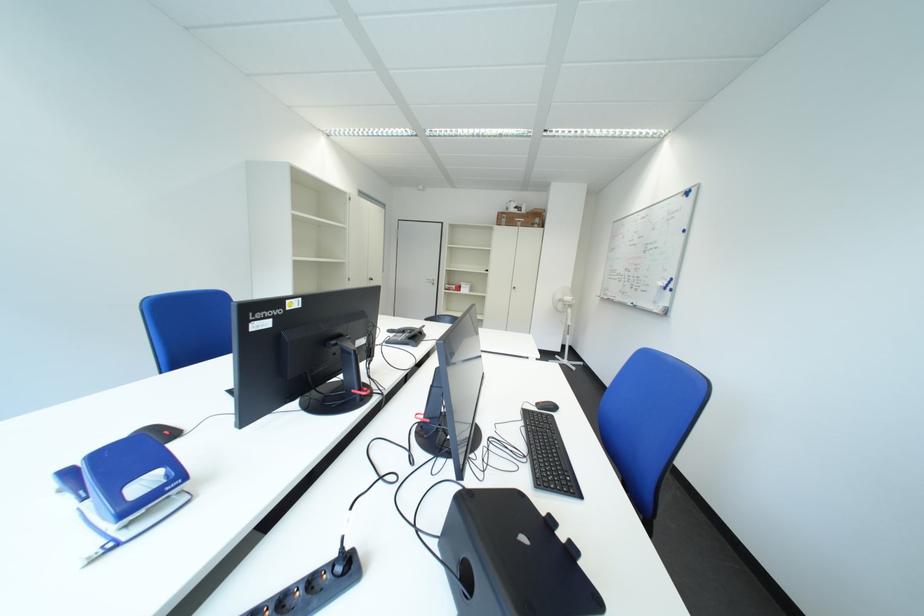
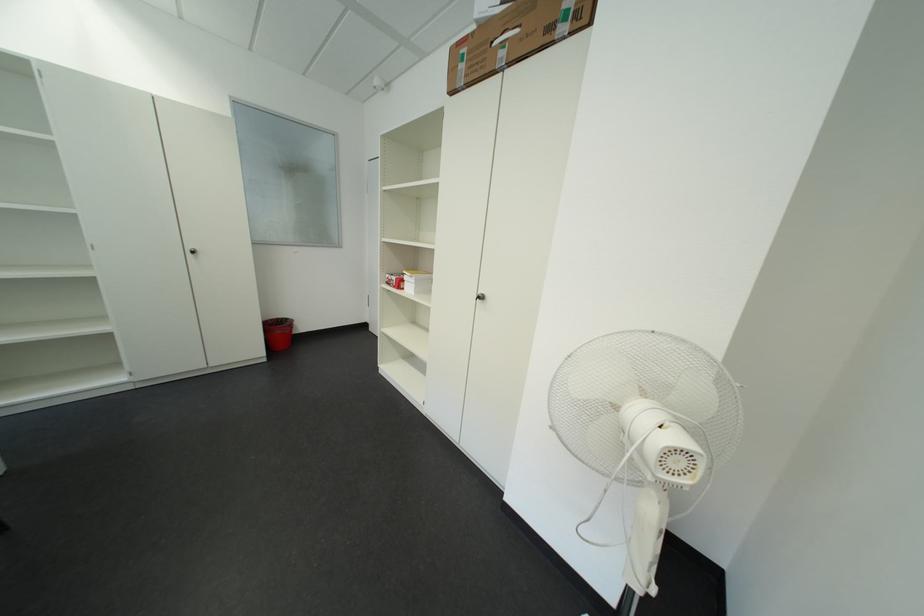
The point at (470, 291) is marked in the first image. Where is the corresponding point in the second image?

(411, 286)